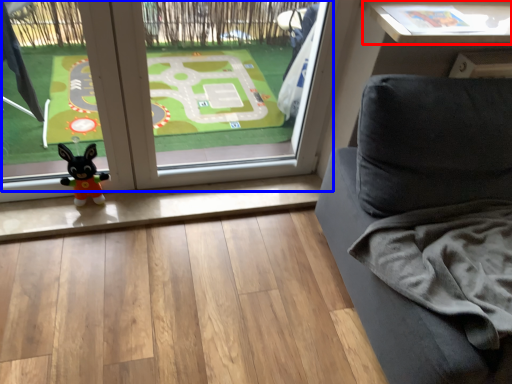
Question: Among these objects, which one is farthest to the camera, table (highlighted by a red box) or window (highlighted by a blue box)?

Choices:
 (A) table
 (B) window

Answer: (A)